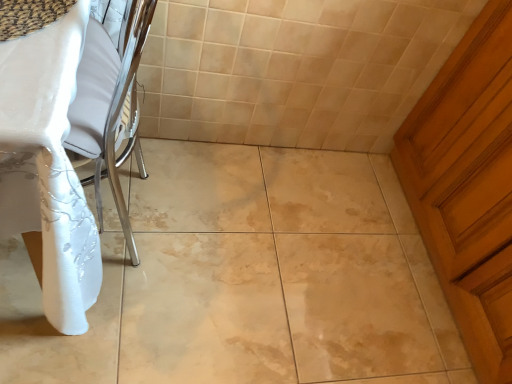
Question: Is wooden door at right not within white glossy table at left?

Choices:
 (A) yes
 (B) no

Answer: (A)

Question: From the image's perspective, is wooden door at right located beneath white glossy table at left?

Choices:
 (A) yes
 (B) no

Answer: (A)

Question: Is wooden door at right touching white glossy table at left?

Choices:
 (A) no
 (B) yes

Answer: (A)

Question: Does wooden door at right have a greater width compared to white glossy table at left?

Choices:
 (A) no
 (B) yes

Answer: (A)

Question: From a real-world perspective, is wooden door at right located higher than white glossy table at left?

Choices:
 (A) no
 (B) yes

Answer: (A)

Question: Is wooden door at right smaller than white glossy table at left?

Choices:
 (A) no
 (B) yes

Answer: (A)

Question: From the image's perspective, is white glossy table at left beneath wooden door at right?

Choices:
 (A) yes
 (B) no

Answer: (B)

Question: From a real-world perspective, is white glossy table at left physically below wooden door at right?

Choices:
 (A) yes
 (B) no

Answer: (B)

Question: Is wooden door at right surrounded by white glossy table at left?

Choices:
 (A) yes
 (B) no

Answer: (B)

Question: Is white glossy table at left positioned in front of wooden door at right?

Choices:
 (A) no
 (B) yes

Answer: (B)

Question: Is white glossy table at left far from wooden door at right?

Choices:
 (A) yes
 (B) no

Answer: (A)

Question: Is white glossy table at left at the left side of wooden door at right?

Choices:
 (A) no
 (B) yes

Answer: (B)

Question: Considering the positions of wooden door at right and white glossy table at left in the image, is wooden door at right bigger or smaller than white glossy table at left?

Choices:
 (A) big
 (B) small

Answer: (A)